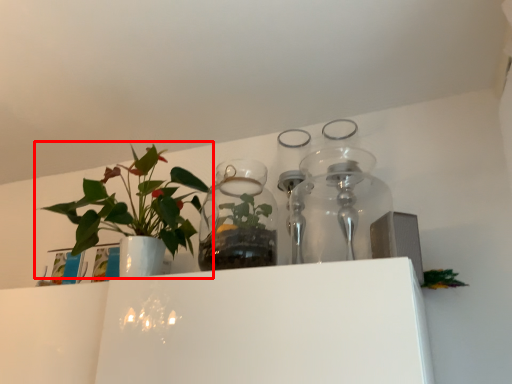
Question: In this image, where is houseplant (annotated by the red box) located relative to vase?

Choices:
 (A) left
 (B) right

Answer: (A)